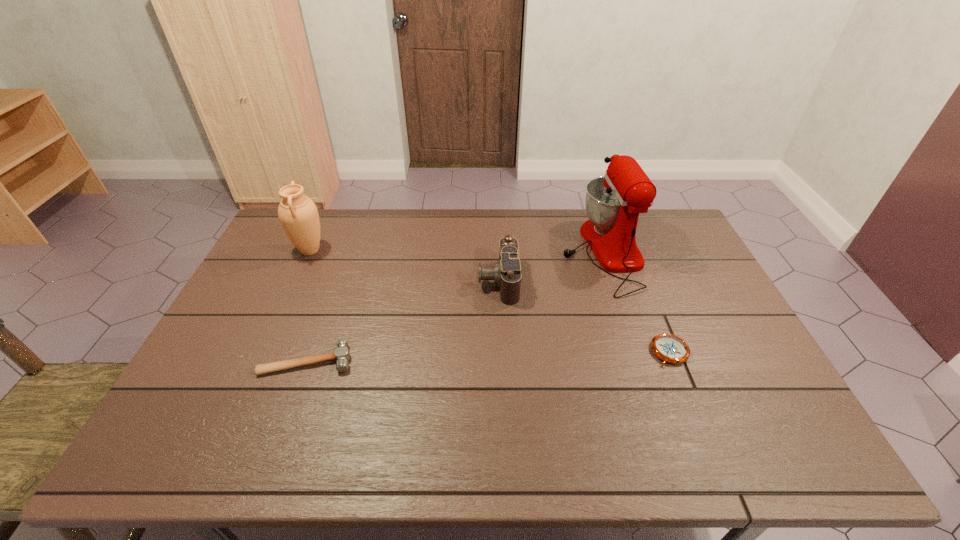
Locate an element on the screen. This screenshot has width=960, height=540. blank space located 0.200m on the front-facing side of the camera is located at coordinates (416, 281).

You are a GUI agent. You are given a task and a screenshot of the screen. Output one action in this format:
    pyautogui.click(x=<x>, y=<y>)
    Task: Click on the vacant region located 0.390m on the front-facing side of the camera
    The height and width of the screenshot is (540, 960).
    Given the screenshot: What is the action you would take?
    tap(356, 281)

Where is `vacant area situated 0.370m on the front-facing side of the camera`? This screenshot has height=540, width=960. vacant area situated 0.370m on the front-facing side of the camera is located at coordinates (362, 281).

You are a GUI agent. You are given a task and a screenshot of the screen. Output one action in this format:
    pyautogui.click(x=<x>, y=<y>)
    Task: Click on the free location located on the back of the hammer
    The image size is (960, 540).
    Given the screenshot: What is the action you would take?
    pyautogui.click(x=319, y=327)

The height and width of the screenshot is (540, 960). What are the coordinates of `free space located 0.100m on the right of the shortest object` in the screenshot? It's located at (726, 352).

Identify the location of mixer at the far edge. (613, 202).

The image size is (960, 540). In order to click on urn that is positioned at the far edge in this screenshot , I will do `click(298, 214)`.

Identify the location of urn positioned at the left edge. This screenshot has width=960, height=540. coord(298,214).

This screenshot has height=540, width=960. Find the location of `hammer that is at the left edge`. hammer that is at the left edge is located at coordinates (341, 354).

This screenshot has height=540, width=960. Find the location of `object that is at the far left corner`. object that is at the far left corner is located at coordinates (298, 214).